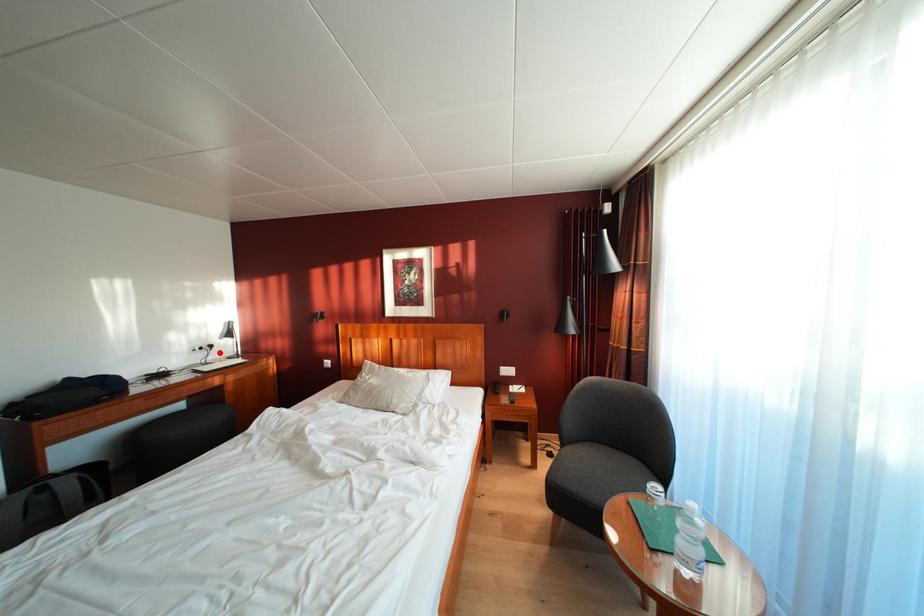
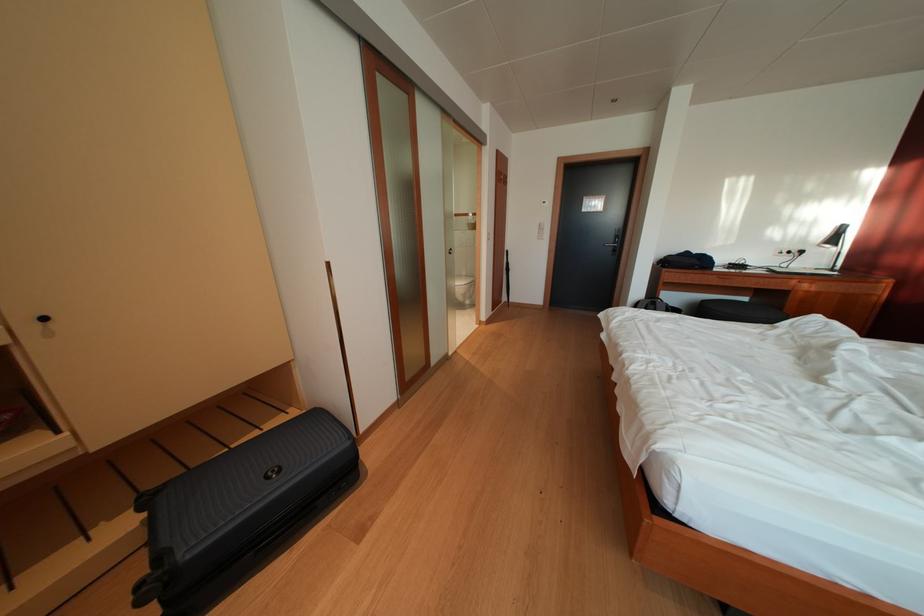
Where in the second image is the point corresponding to the highlighted location from the first image?

(809, 257)